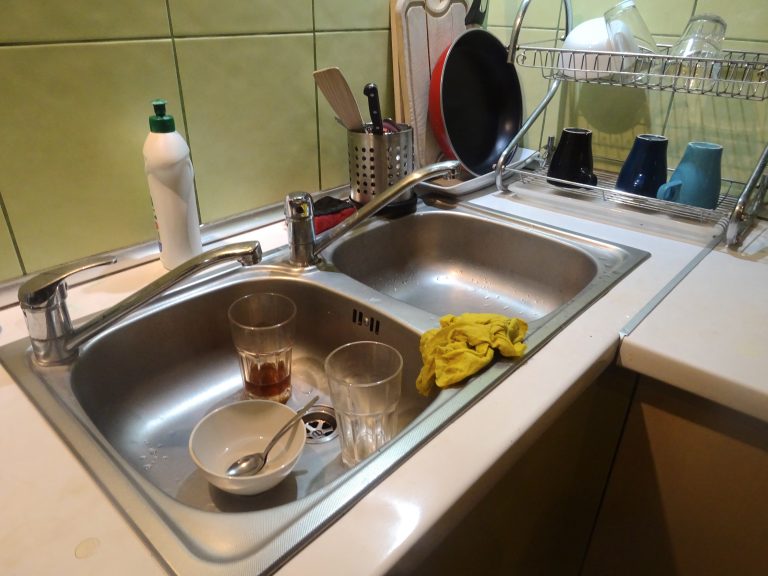
The width and height of the screenshot is (768, 576). I want to click on frying pan, so click(x=464, y=106).